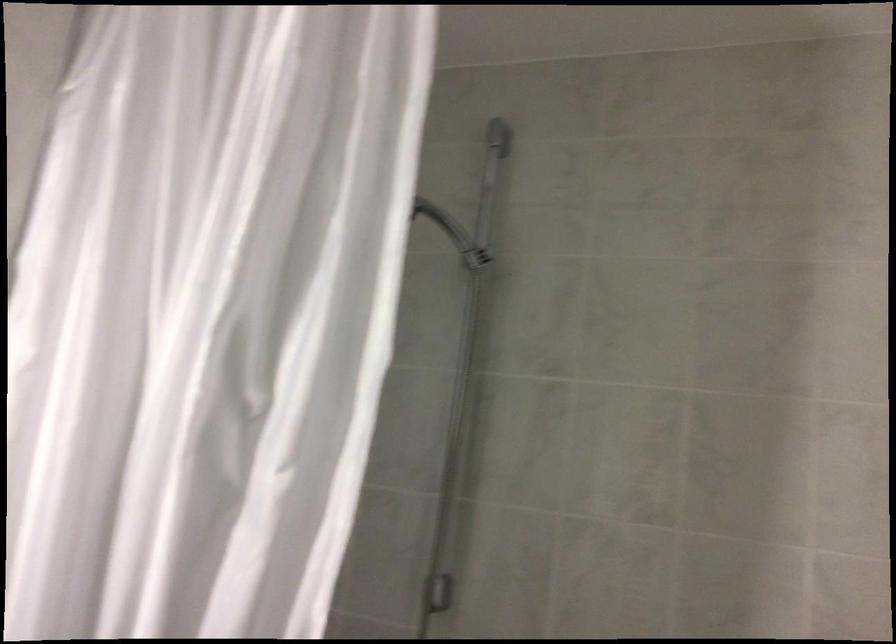
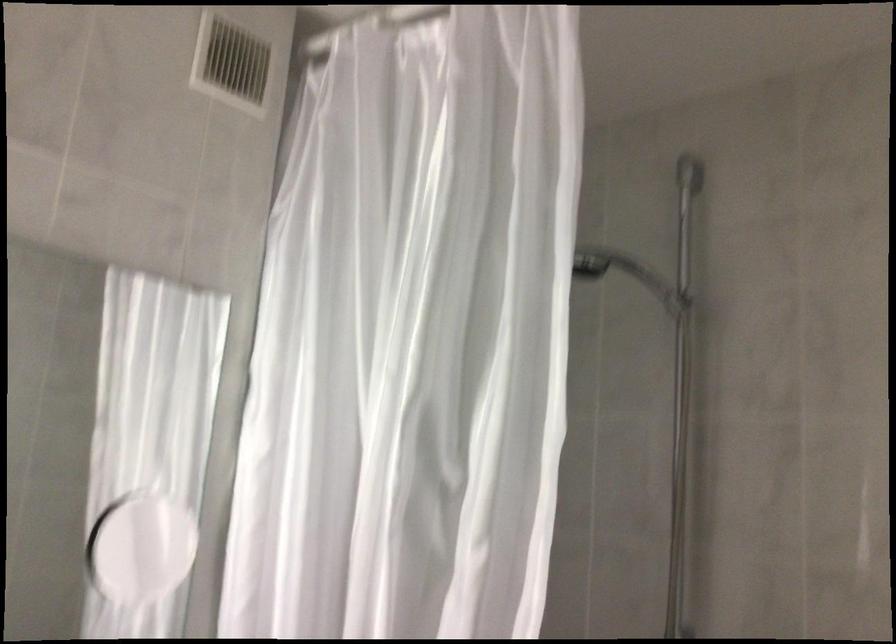
Where in the second image is the point corresponding to the point at 230,243 from the first image?

(412, 337)